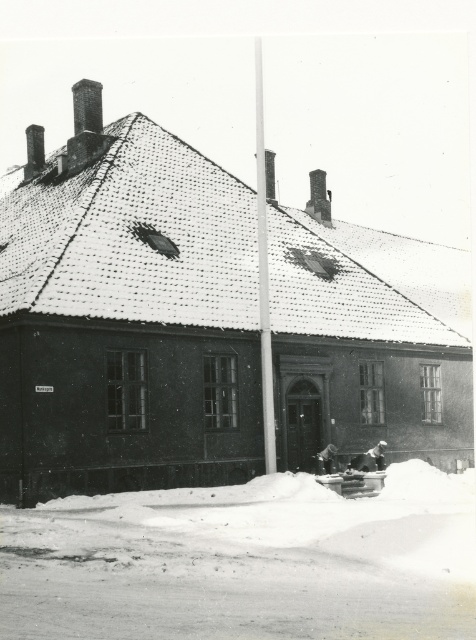
You are standing in front of the building and want to place a small decorative snowman exactly at the location where the white powdery snow at lower center is thickest. According to the image, where should you place the snowman?

You should place the snowman at point (246, 563) where the white powdery snow at lower center is thickest.

You are standing at the central door of the building in the image. You notice a point marked at coordinates point (246, 563). Based on the scene description, where is this point located relative to the flagpole?

The point (246, 563) is located on white powdery snow at lower center, which is in front of the building where the flagpole is situated. Since the flagpole is in front of the building, the point is near the flagpole area on the snowy ground.

You are a photographer standing in front of the building and want to capture a photo that includes both the white powdery snow at lower center and the smooth white pole at center. Which object will appear larger in the photo?

The white powdery snow at lower center will appear larger in the photo because it is closer to the viewer than the smooth white pole at center.